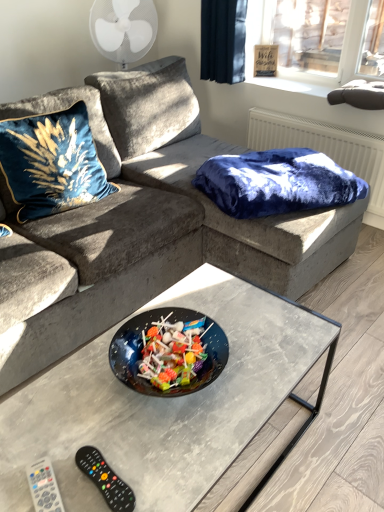
Question: Looking at their shapes, would you say black plastic remote at lower left, which ranks as the 2th remote in left-to-right order, is wider or thinner than velvet blue blanket at upper right?

Choices:
 (A) wide
 (B) thin

Answer: (B)

Question: Considering the positions of point (94, 451) and point (306, 147), is point (94, 451) closer or farther from the camera than point (306, 147)?

Choices:
 (A) farther
 (B) closer

Answer: (B)

Question: Estimate the real-world distances between objects in this image. Which object is farther from the white plastic remote at lower left, which is the second remote in right-to-left order?

Choices:
 (A) velvet fabric couch at center
 (B) velvet blue blanket at upper right
 (C) velvet blue pillow at upper left
 (D) black plastic remote at lower left, which ranks as the 2th remote in left-to-right order

Answer: (B)

Question: Estimate the real-world distances between objects in this image. Which object is farther from the velvet blue blanket at upper right?

Choices:
 (A) black plastic remote at lower left, which ranks as the 2th remote in left-to-right order
 (B) velvet blue pillow at upper left
 (C) velvet fabric couch at center
 (D) white plastic remote at lower left, the first remote positioned from the left

Answer: (D)